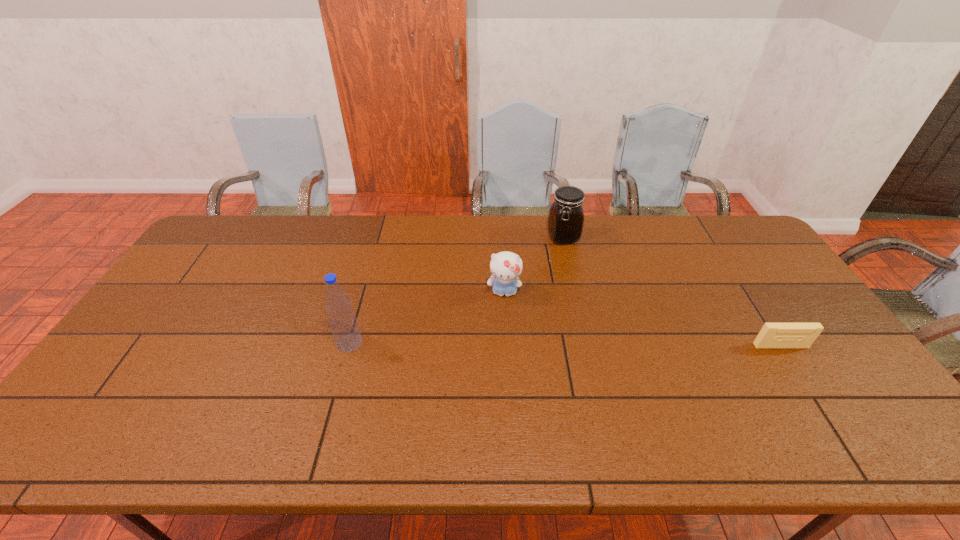
In the image, there is a desktop. Identify the location of free space at the left edge. pos(204,295).

Identify the location of blank space at the right edge of the desktop. (803, 377).

In the image, there is a desktop. Where is `vacant space at the far left corner`? The image size is (960, 540). vacant space at the far left corner is located at coordinates (204, 251).

In the image, there is a desktop. Identify the location of vacant area at the near right corner. (860, 382).

This screenshot has height=540, width=960. In order to click on free point between the jar and the rightmost object in this screenshot , I will do `click(672, 292)`.

Find the location of a particular element. This screenshot has height=540, width=960. free spot between the kitten and the leftmost object is located at coordinates (427, 318).

Find the location of a particular element. free space between the kitten and the shortest object is located at coordinates (642, 320).

Locate an element on the screen. Image resolution: width=960 pixels, height=540 pixels. vacant area between the second shortest object and the rightmost object is located at coordinates (642, 320).

I want to click on vacant area that lies between the videotape and the second shortest object, so click(642, 320).

Where is `free space between the kitten and the farthest object`? free space between the kitten and the farthest object is located at coordinates (534, 265).